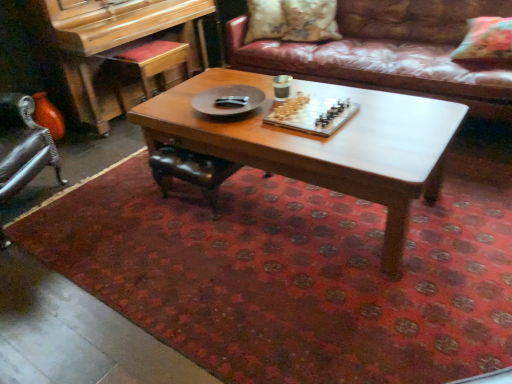
You are a GUI agent. You are given a task and a screenshot of the screen. Output one action in this format:
    pyautogui.click(x=<x>, y=<y>)
    Task: Click on the free spot above translucent glass chessboard at center (from a real-world perspective)
    The height and width of the screenshot is (384, 512).
    Given the screenshot: What is the action you would take?
    (x=311, y=114)